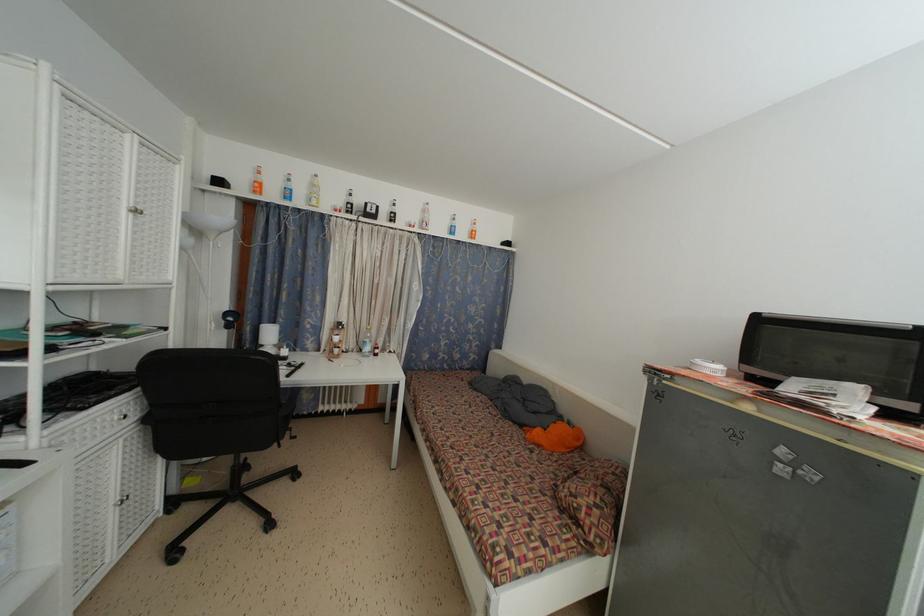
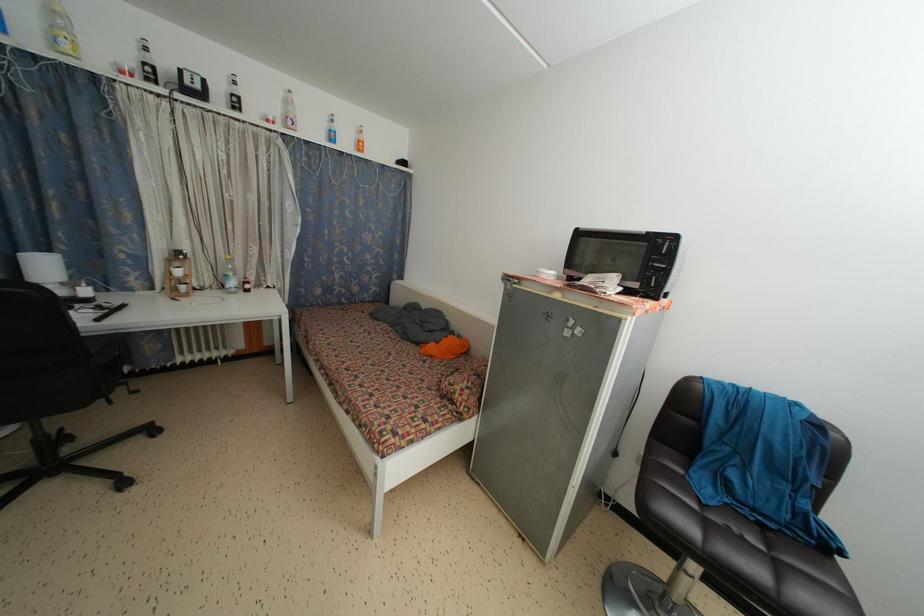
The point at (x=371, y=354) is marked in the first image. Where is the corresponding point in the second image?

(237, 289)